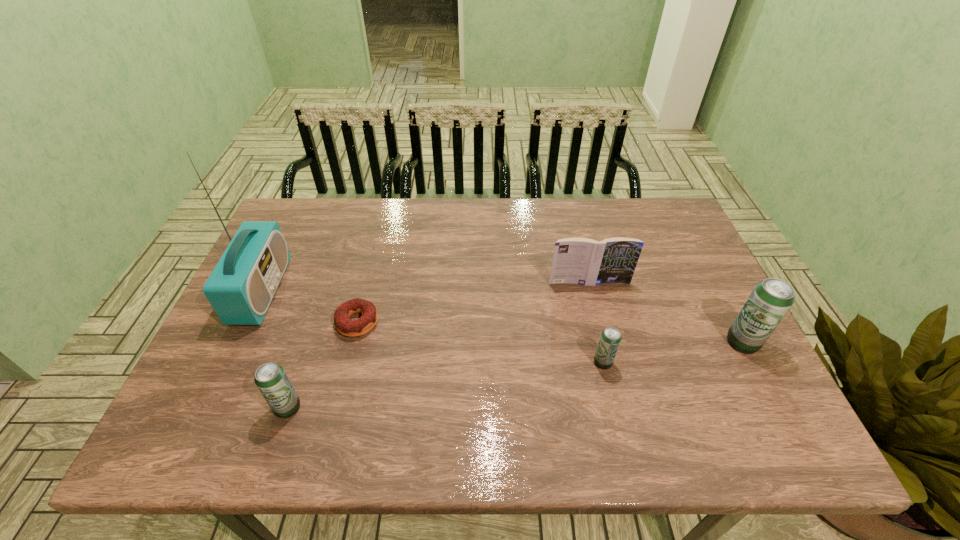
Where is `book`? book is located at coordinates (583, 261).

This screenshot has height=540, width=960. I want to click on vacant area located 0.130m on the right of the second shortest beer can, so coord(361,408).

Locate an element on the screen. The image size is (960, 540). vacant area situated 0.300m on the right of the second beer can from right to left is located at coordinates (739, 362).

Locate an element on the screen. The width and height of the screenshot is (960, 540). free space located 0.100m on the back of the tallest beer can is located at coordinates (721, 300).

Identify the location of vacant space situated on the back of the shortest object. Image resolution: width=960 pixels, height=540 pixels. tap(382, 224).

The width and height of the screenshot is (960, 540). I want to click on vacant space located on the front panel of the tallest object, so click(x=424, y=291).

This screenshot has width=960, height=540. In order to click on blank space located 0.110m on the front cover of the book in this screenshot , I will do `click(597, 316)`.

The height and width of the screenshot is (540, 960). Find the location of `object that is at the near edge`. object that is at the near edge is located at coordinates (270, 378).

Identify the location of object present at the left edge. Image resolution: width=960 pixels, height=540 pixels. [240, 289].

This screenshot has height=540, width=960. I want to click on object that is at the right edge, so click(770, 300).